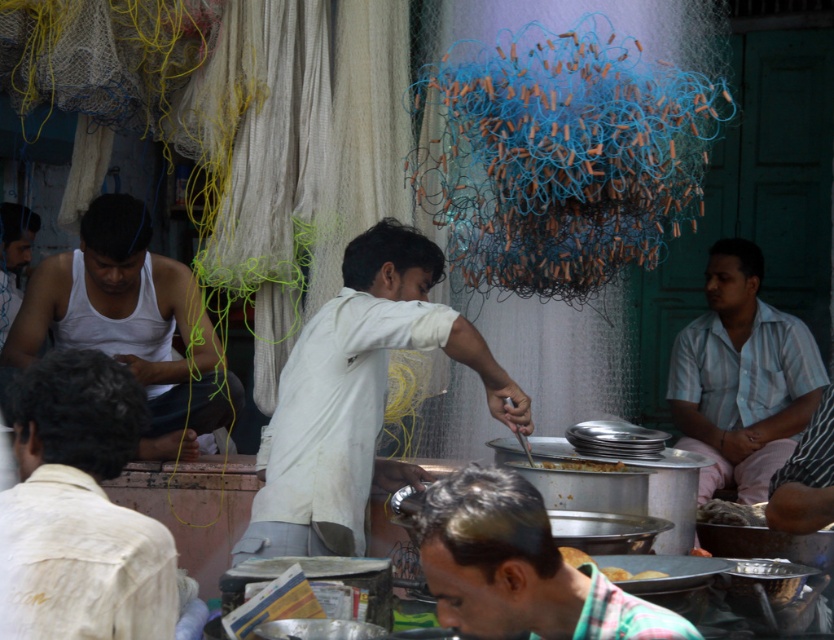
Question: Which of the following is the closest to the observer?

Choices:
 (A) white matte tank top at left
 (B) green plaid shirt at center
 (C) light beige shirt at lower left
 (D) white striped shirt at right

Answer: (B)

Question: Which object appears farthest from the camera in this image?

Choices:
 (A) yellow matte bread at center
 (B) white cotton shirt at center
 (C) white striped shirt at right

Answer: (C)

Question: Is the position of light beige shirt at lower left less distant than that of white striped shirt at right?

Choices:
 (A) no
 (B) yes

Answer: (B)

Question: Does white matte tank top at left come in front of yellow matte bread at center?

Choices:
 (A) no
 (B) yes

Answer: (A)

Question: Which is nearer to the white cotton shirt at center?

Choices:
 (A) green plaid shirt at center
 (B) yellow matte bread at center

Answer: (B)

Question: Does green plaid shirt at center lie behind white striped shirt at right?

Choices:
 (A) yes
 (B) no

Answer: (B)